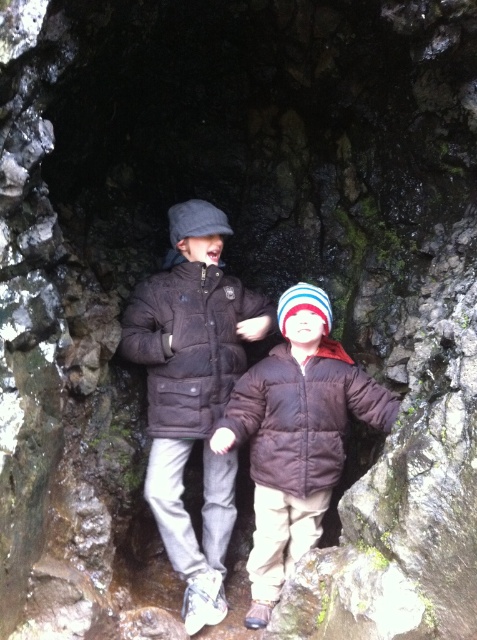
You are a photographer trying to capture both the matte black jacket at center and the brown puffy coat at center in a single frame. Since the lighting is dim, you need to adjust your camera settings. However, you also want to ensure that both subjects are visible. Given their positions, which jacket should you focus on first to ensure proper exposure, considering their placement relative to the light source?

The matte black jacket at center should be focused on first because it is positioned on the left side of the brown puffy coat at center, which is closer to the entrance where the natural light is filtering through. This ensures proper exposure for both subjects by starting with the darker, less illuminated area.

You are a photographer trying to capture a clear photo of the matte black jacket at center. Your camera is positioned where you are standing. What is the minimum distance you need to move towards or away from the jacket to ensure it fits perfectly in your camera frame?

The matte black jacket at center and camera are 39.24 inches apart. To ensure the jacket fits perfectly in the frame, you should move to maintain this distance as the optimal focal length for the camera lens.